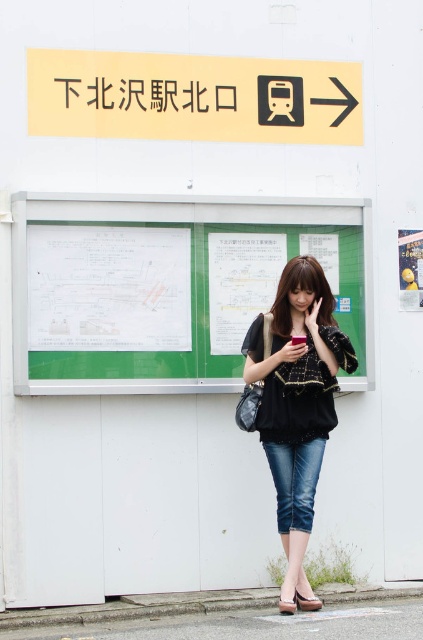
Question: Which of the following is the closest to the observer?

Choices:
 (A) leather sandal at lower center
 (B) denim jeans at lower center
 (C) white paper poster at right

Answer: (A)

Question: Observing the image, what is the correct spatial positioning of yellow/yellowish plastic sign at upper center in reference to green paperboard poster at center?

Choices:
 (A) above
 (B) below

Answer: (A)

Question: Observing the image, what is the correct spatial positioning of white paper poster at right in reference to leather sandal at lower center?

Choices:
 (A) left
 (B) right

Answer: (B)

Question: Among these objects, which one is farthest from the camera?

Choices:
 (A) yellow/yellowish plastic sign at upper center
 (B) green matte bulletin board at center
 (C) white paper poster at right
 (D) green paperboard poster at center

Answer: (C)

Question: From the image, what is the correct spatial relationship of white paper at center in relation to matte brown sandal at lower center?

Choices:
 (A) below
 (B) above

Answer: (B)

Question: Which object appears closest to the camera in this image?

Choices:
 (A) green matte bulletin board at center
 (B) white paper poster at right
 (C) yellow/yellowish plastic sign at upper center
 (D) denim jeans at center

Answer: (D)